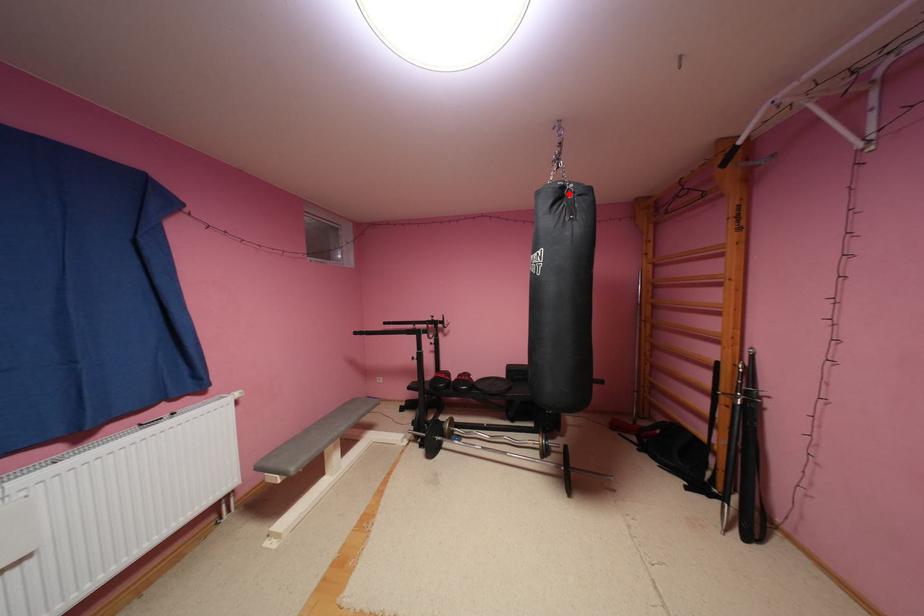
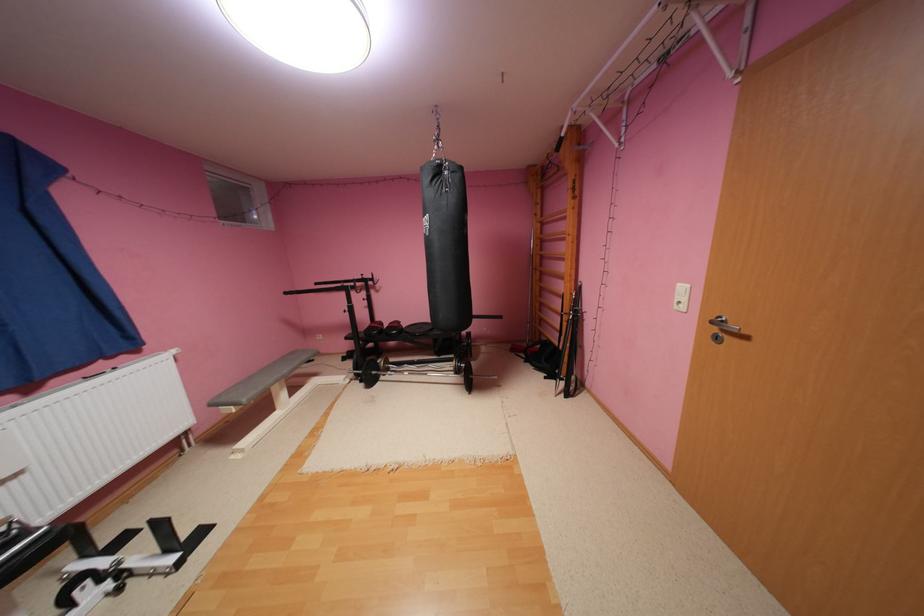
Question: I am providing you with two images of the same scene from different viewpoints. A red point is marked on the first image. At the location where the point appears in image 1, is it still visible in image 2?

Choices:
 (A) Yes
 (B) No

Answer: (A)